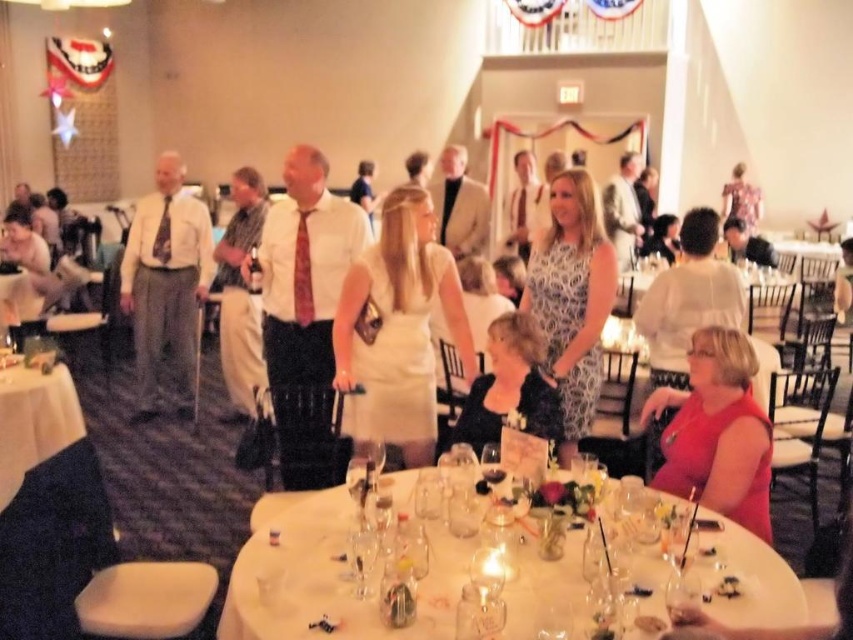
Consider the image. Who is taller, white glossy table at lower center or pink satin tie at center?

pink satin tie at center is taller.

Does point (431, 550) come farther from viewer compared to point (300, 257)?

No, (431, 550) is closer to viewer.

Identify the location of white glossy table at lower center. The width and height of the screenshot is (853, 640). (332, 579).

Locate an element on the screen. black satin dress at center is located at coordinates (509, 387).

Which is above, black satin dress at center or patterned silk tie at center?

patterned silk tie at center

Who is more distant from viewer, (491, 390) or (165, 198)?

Positioned behind is point (165, 198).

Find the location of a particular element. This screenshot has height=640, width=853. black satin dress at center is located at coordinates (509, 387).

Does black satin dress at center appear on the right side of white tablecloth at lower left?

Yes, black satin dress at center is to the right of white tablecloth at lower left.

Who is more distant from viewer, [480,374] or [4,394]?

The point [4,394] is more distant.

Between point (492, 433) and point (51, 392), which one is positioned in front?

Point (492, 433)

At what (x,y) coordinates should I click in order to perform the action: click on black satin dress at center. Please return your answer as a coordinate pair (x, y). The width and height of the screenshot is (853, 640). Looking at the image, I should click on (509, 387).